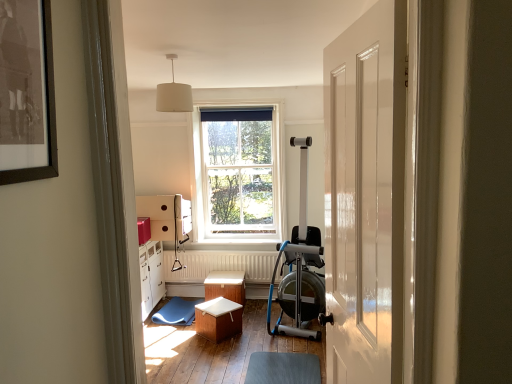
Question: From the image's perspective, is white fabric lampshade at upper center on wooden stool at center, which is the 2th stool in front-to-back order?

Choices:
 (A) no
 (B) yes

Answer: (B)

Question: Is white fabric lampshade at upper center looking in the opposite direction of wooden stool at center, which is counted as the 1th stool, starting from the back?

Choices:
 (A) no
 (B) yes

Answer: (A)

Question: Is white fabric lampshade at upper center in front of wooden stool at center, which is counted as the 1th stool, starting from the back?

Choices:
 (A) no
 (B) yes

Answer: (B)

Question: Is white fabric lampshade at upper center outside wooden stool at center, which is counted as the 1th stool, starting from the back?

Choices:
 (A) yes
 (B) no

Answer: (A)

Question: Is the position of white fabric lampshade at upper center more distant than that of wooden stool at center, which is counted as the 1th stool, starting from the back?

Choices:
 (A) no
 (B) yes

Answer: (A)

Question: From the image's perspective, is wooden box at center above or below white textured radiator at center?

Choices:
 (A) above
 (B) below

Answer: (B)

Question: From their relative heights in the image, would you say wooden box at center is taller or shorter than white textured radiator at center?

Choices:
 (A) short
 (B) tall

Answer: (A)

Question: From a real-world perspective, is wooden box at center positioned above or below white textured radiator at center?

Choices:
 (A) below
 (B) above

Answer: (A)

Question: Looking at the image, does wooden box at center seem bigger or smaller compared to white textured radiator at center?

Choices:
 (A) small
 (B) big

Answer: (B)

Question: Relative to wooden stool at center, which ranks as the first stool in front-to-back order, is wooden stool at center, which is counted as the 1th stool, starting from the back, in front or behind?

Choices:
 (A) front
 (B) behind

Answer: (B)

Question: In terms of height, does wooden stool at center, which is counted as the 1th stool, starting from the back, look taller or shorter compared to wooden stool at center, which ranks as the first stool in front-to-back order?

Choices:
 (A) tall
 (B) short

Answer: (A)

Question: In the image, is wooden stool at center, which is counted as the 1th stool, starting from the back, on the left side or the right side of wooden stool at center, which ranks as the first stool in front-to-back order?

Choices:
 (A) left
 (B) right

Answer: (B)

Question: From a real-world perspective, is wooden stool at center, which is the 2th stool in front-to-back order, above or below wooden stool at center, which ranks as the first stool in front-to-back order?

Choices:
 (A) below
 (B) above

Answer: (B)

Question: Considering the positions of wooden stool at center, which ranks as the first stool in front-to-back order, and white fabric lampshade at upper center in the image, is wooden stool at center, which ranks as the first stool in front-to-back order, wider or thinner than white fabric lampshade at upper center?

Choices:
 (A) wide
 (B) thin

Answer: (A)

Question: From the image's perspective, relative to white fabric lampshade at upper center, is wooden stool at center, which ranks as the first stool in front-to-back order, above or below?

Choices:
 (A) above
 (B) below

Answer: (B)